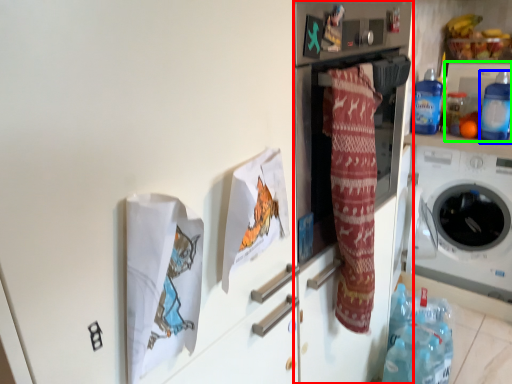
Question: Considering the real-world distances, which object is closest to fridge (highlighted by a red box)? bottle (highlighted by a blue box) or appliance (highlighted by a green box).

Choices:
 (A) bottle
 (B) appliance

Answer: (A)